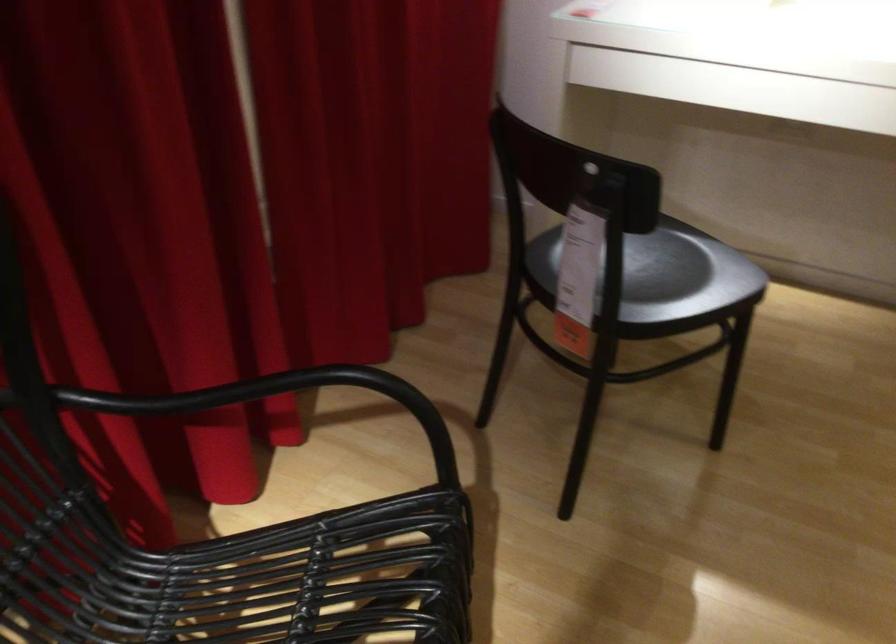
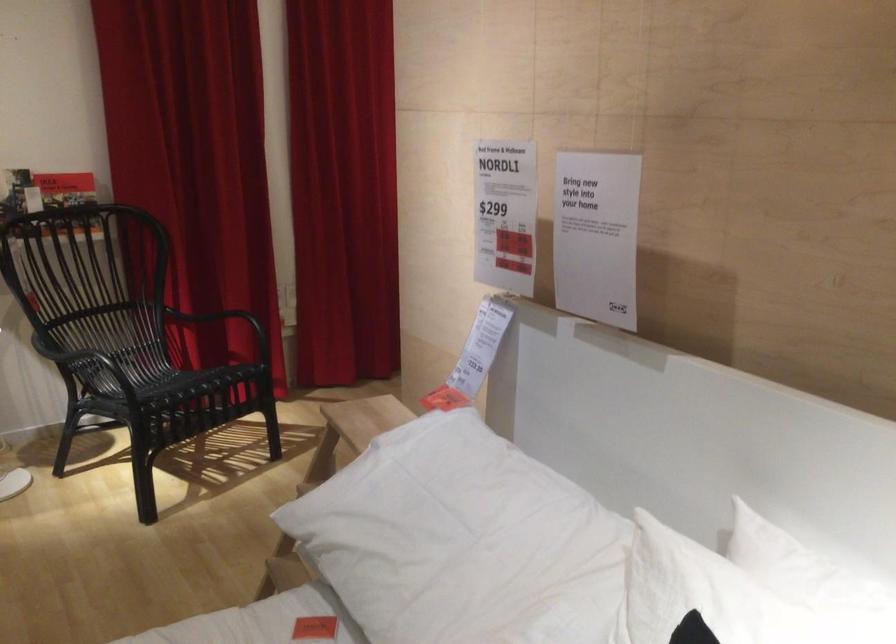
The images are taken continuously from a first-person perspective. In which direction are you moving?

The cameraman moved toward right, backward.